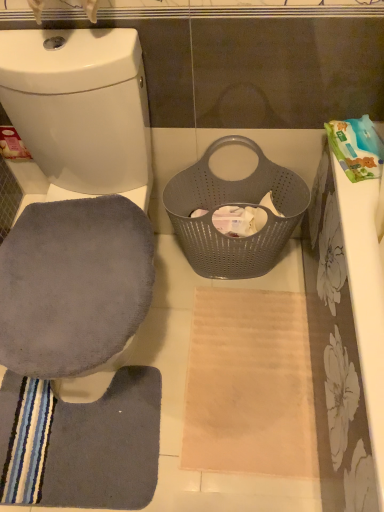
What is the approximate width of gray perforated basket at center?

It is 9.55 inches.

Describe the element at coordinates (233, 204) in the screenshot. I see `gray perforated basket at center` at that location.

I want to click on gray soft mat at lower left, so click(x=85, y=443).

From the image's perspective, would you say white fabric toilet paper at center is positioned over gray soft mat at lower left?

Correct, white fabric toilet paper at center appears higher than gray soft mat at lower left in the image.

Between white fabric toilet paper at center and gray soft mat at lower left, which one appears on the right side from the viewer's perspective?

white fabric toilet paper at center is more to the right.

Consider the image. Is white fabric toilet paper at center behind gray soft mat at lower left?

Yes, it is.

Considering the sizes of objects gray suede swivel chair at left and gray fabric toilet seat at left in the image provided, who is smaller, gray suede swivel chair at left or gray fabric toilet seat at left?

gray suede swivel chair at left is smaller.

Is gray fabric toilet seat at left a part of gray suede swivel chair at left?

No.

Does gray suede swivel chair at left appear on the left side of gray fabric toilet seat at left?

No.

At what (x,y) coordinates should I click in order to perform the action: click on toilet that appears above the gray suede swivel chair at left (from the image's perspective). Please return your answer as a coordinate pair (x, y). The width and height of the screenshot is (384, 512). Looking at the image, I should click on (78, 113).

From the image's perspective, between gray fabric toilet seat at left and gray soft mat at lower left, which one is located above?

gray fabric toilet seat at left, from the image's perspective.

Who is taller, gray fabric toilet seat at left or gray soft mat at lower left?

With more height is gray fabric toilet seat at left.

Based on their positions, is gray fabric toilet seat at left located to the left or right of gray soft mat at lower left?

From the image, it's evident that gray fabric toilet seat at left is to the left of gray soft mat at lower left.

How much distance is there between gray fabric toilet seat at left and gray soft mat at lower left?

gray fabric toilet seat at left is 28.23 inches from gray soft mat at lower left.

Is point (120, 243) positioned after point (5, 436)?

No, (120, 243) is in front of (5, 436).

Which of these two, gray suede swivel chair at left or gray soft mat at lower left, is bigger?

gray suede swivel chair at left is bigger.

Consider the image. Is gray suede swivel chair at left at the right side of gray soft mat at lower left?

Yes.

Is gray suede swivel chair at left looking in the opposite direction of gray soft mat at lower left?

gray suede swivel chair at left is not turned away from gray soft mat at lower left.

In the scene shown: From the image's perspective, is gray soft mat at lower left positioned above or below gray perforated basket at center?

gray soft mat at lower left is below gray perforated basket at center.

Between gray soft mat at lower left and gray perforated basket at center, which one is positioned in front?

Positioned in front is gray perforated basket at center.

Based on the photo, who is shorter, gray soft mat at lower left or gray perforated basket at center?

Standing shorter between the two is gray soft mat at lower left.

Looking at this image, could gray perforated basket at center be considered to be inside gray soft mat at lower left?

Definitely not — gray perforated basket at center is not inside gray soft mat at lower left.

Does gray soft mat at lower left have a greater width compared to gray fabric toilet seat at left?

Incorrect, the width of gray soft mat at lower left does not surpass that of gray fabric toilet seat at left.

Is gray soft mat at lower left looking in the opposite direction of gray fabric toilet seat at left?

Absolutely, gray soft mat at lower left is directed away from gray fabric toilet seat at left.

Is the position of gray soft mat at lower left more distant than that of gray fabric toilet seat at left?

Yes, it is.

Looking at this image, which is behind, gray soft mat at lower left or white fabric toilet paper at center?

Positioned behind is white fabric toilet paper at center.

In terms of height, does gray soft mat at lower left look taller or shorter compared to white fabric toilet paper at center?

Considering their sizes, gray soft mat at lower left has less height than white fabric toilet paper at center.

Could you tell me if gray soft mat at lower left is facing white fabric toilet paper at center?

No.

Would you say white fabric toilet paper at center is part of gray soft mat at lower left's contents?

No, white fabric toilet paper at center is not a part of gray soft mat at lower left.

Locate an element on the screen. The height and width of the screenshot is (512, 384). toilet paper above the gray soft mat at lower left (from the image's perspective) is located at coordinates (239, 220).

This screenshot has width=384, height=512. Find the location of `swivel chair located on the right of gray fabric toilet seat at left`. swivel chair located on the right of gray fabric toilet seat at left is located at coordinates (73, 285).

Looking at the image, which one is located closer to gray suede swivel chair at left, gray fabric toilet seat at left or gray perforated basket at center?

Among the two, gray fabric toilet seat at left is located nearer to gray suede swivel chair at left.

Which object lies nearer to the anchor point white fabric toilet paper at center, gray suede swivel chair at left or gray fabric toilet seat at left?

The object closer to white fabric toilet paper at center is gray fabric toilet seat at left.

Looking at this image, considering their positions, is gray fabric toilet seat at left positioned further to gray soft mat at lower left than gray suede swivel chair at left?

gray fabric toilet seat at left lies further to gray soft mat at lower left than the other object.

Based on the photo, considering their positions, is gray perforated basket at center positioned closer to gray suede swivel chair at left than white fabric toilet paper at center?

Based on the image, gray perforated basket at center appears to be nearer to gray suede swivel chair at left.

Considering their positions, is gray suede swivel chair at left positioned further to gray soft mat at lower left than gray fabric toilet seat at left?

gray fabric toilet seat at left lies further to gray soft mat at lower left than the other object.

Estimate the real-world distances between objects in this image. Which object is further from gray suede swivel chair at left, gray soft mat at lower left or white fabric toilet paper at center?

Based on the image, gray soft mat at lower left appears to be further to gray suede swivel chair at left.

Consider the image. Which object lies further to the anchor point white fabric toilet paper at center, gray soft mat at lower left or gray suede swivel chair at left?

gray soft mat at lower left.

When comparing their distances from gray fabric toilet seat at left, does white fabric toilet paper at center or gray suede swivel chair at left seem further?

The object further to gray fabric toilet seat at left is white fabric toilet paper at center.

This screenshot has width=384, height=512. Identify the location of swivel chair between gray fabric toilet seat at left and white fabric toilet paper at center in the front-back direction. tap(73, 285).

In order to click on basket located between gray fabric toilet seat at left and white fabric toilet paper at center in the depth direction in this screenshot , I will do `click(233, 204)`.

Locate an element on the screen. basket between white fabric toilet paper at center and gray soft mat at lower left vertically is located at coordinates (233, 204).

The image size is (384, 512). In order to click on swivel chair located between gray fabric toilet seat at left and gray perforated basket at center in the left-right direction in this screenshot , I will do `click(73, 285)`.